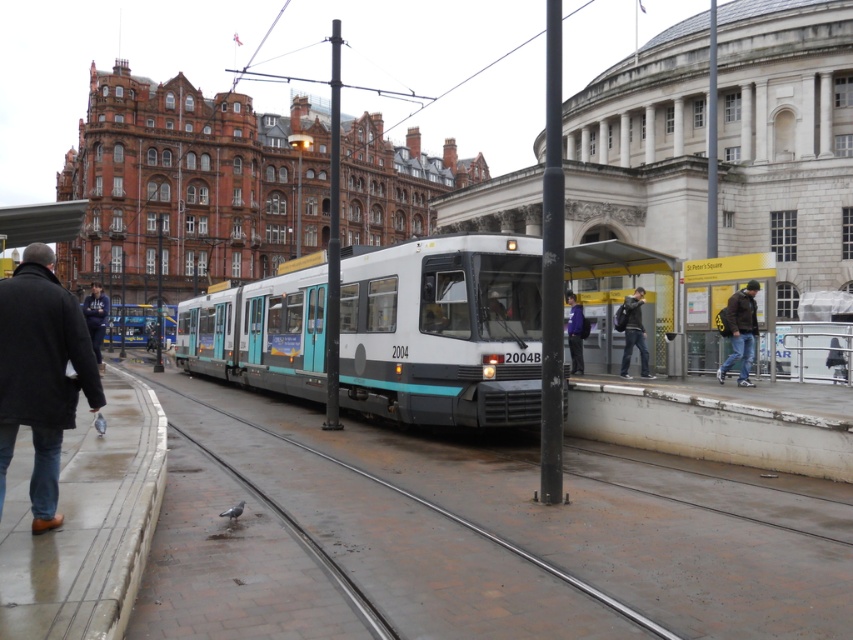
Question: Among these objects, which one is nearest to the camera?

Choices:
 (A) dark brown leather jacket at right
 (B) white glossy train at center
 (C) purple fabric jacket at center
 (D) dark gray backpack at center

Answer: (B)

Question: Which of the following is the closest to the observer?

Choices:
 (A) (630, 248)
 (B) (206, 314)
 (C) (573, 298)

Answer: (A)

Question: Does white glossy train at center appear on the left side of dark blue hoodie at left?

Choices:
 (A) yes
 (B) no

Answer: (B)

Question: Among these points, which one is nearest to the camera?

Choices:
 (A) (49, 310)
 (B) (733, 280)
 (C) (96, 349)

Answer: (A)

Question: Can you confirm if metallic bus stop at right is bigger than purple fabric jacket at center?

Choices:
 (A) yes
 (B) no

Answer: (A)

Question: Is matte black backpack at right closer to the viewer compared to dark brown leather jacket at right?

Choices:
 (A) yes
 (B) no

Answer: (B)